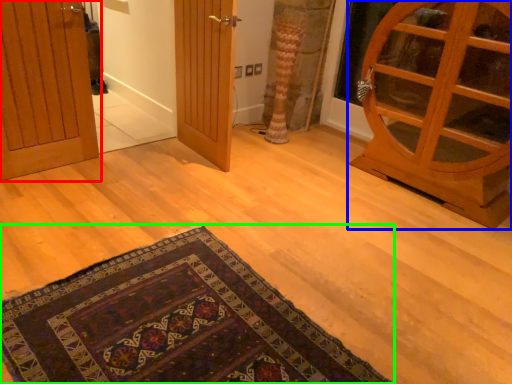
Question: Estimate the real-world distances between objects in this image. Which object is farther from door (highlighted by a red box), door (highlighted by a blue box) or mat (highlighted by a green box)?

Choices:
 (A) door
 (B) mat

Answer: (A)